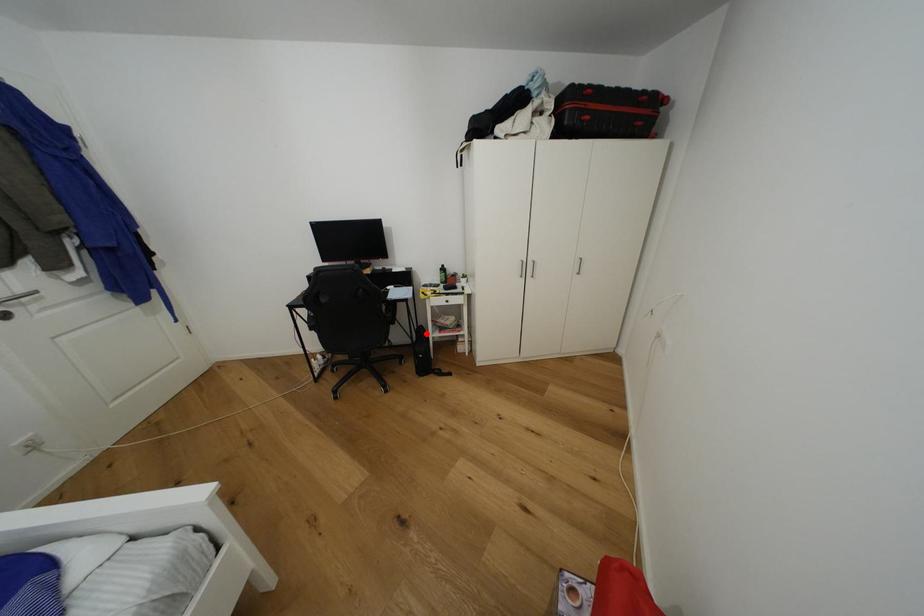
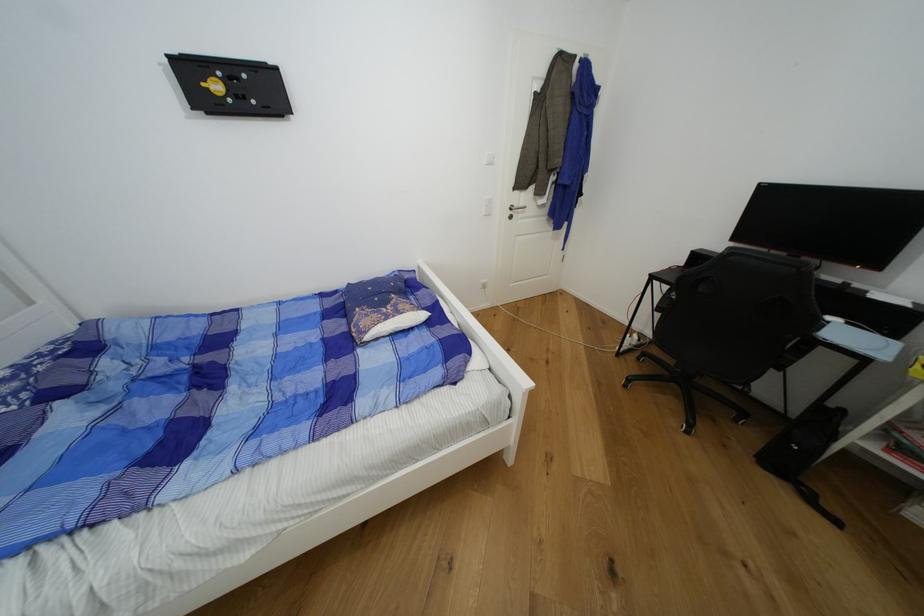
Locate, in the second image, the point that corresponds to the highlighted location in the first image.

(833, 418)